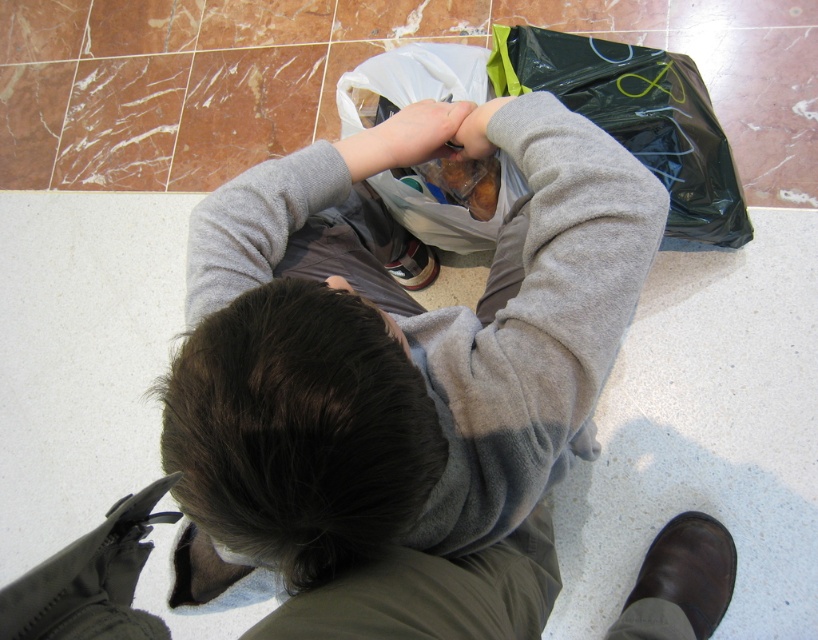
Question: Does dark brown hair at center come in front of matte gray sweater at center?

Choices:
 (A) no
 (B) yes

Answer: (B)

Question: Which of the following is the closest to the observer?

Choices:
 (A) matte gray hand at center
 (B) matte gray sweater at center
 (C) dark brown hair at center

Answer: (C)

Question: Does dark brown hair at center have a smaller size compared to matte gray sweater at center?

Choices:
 (A) yes
 (B) no

Answer: (B)

Question: Does gray fleece sweatshirt at center have a lesser width compared to black plastic bag at center?

Choices:
 (A) no
 (B) yes

Answer: (B)

Question: Which point is closer to the camera taking this photo?

Choices:
 (A) (481, 433)
 (B) (398, 65)
 (C) (390, 452)
 (D) (372, 134)

Answer: (C)

Question: Considering the real-world distances, which object is farthest from the matte gray hand at center?

Choices:
 (A) black plastic bag at center
 (B) matte gray sweater at center
 (C) gray fleece sweatshirt at center

Answer: (A)